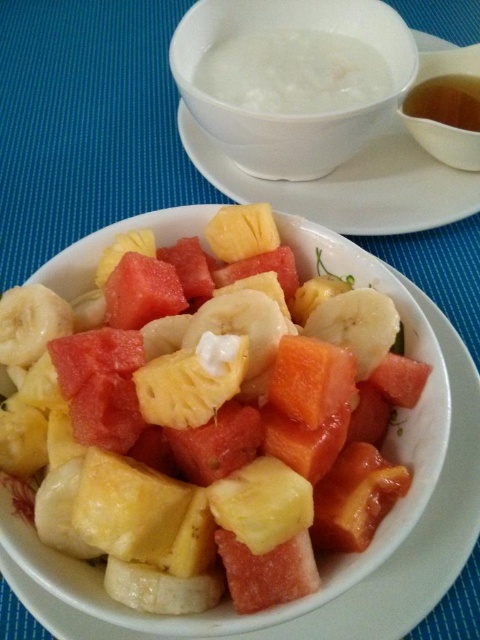
Which of these two, white matte bowl at upper center or white creamy soup at upper center, stands taller?

Standing taller between the two is white matte bowl at upper center.

Is point (325, 1) more distant than point (323, 38)?

No, (325, 1) is in front of (323, 38).

Find the location of a particular element. This screenshot has width=480, height=640. white matte bowl at upper center is located at coordinates pos(291,77).

Can you confirm if yellowish matte pineapple at center is wider than white matte bowl at upper center?

Correct, the width of yellowish matte pineapple at center exceeds that of white matte bowl at upper center.

Does point (170, 531) come farther from viewer compared to point (272, 42)?

That is False.

The height and width of the screenshot is (640, 480). I want to click on yellowish matte pineapple at center, so click(x=204, y=433).

Find the location of `yellowish matte pineapple at center`. yellowish matte pineapple at center is located at coordinates (204, 433).

Identify the location of white matte bowl at upper center. This screenshot has height=640, width=480. (291, 77).

Is white matte bowl at upper center positioned in front of translucent brown liquid at upper right?

Yes, it is.

Locate an element on the screen. The image size is (480, 640). white matte bowl at upper center is located at coordinates (291, 77).

Identify the location of white matte bowl at upper center. coord(291,77).